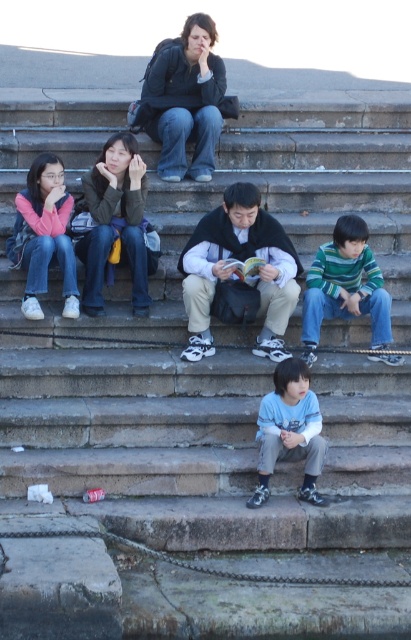
How distant is black matte jacket at center from matte green jacket at center?

They are 95.96 centimeters apart.

I want to click on black matte jacket at center, so click(x=235, y=268).

Which is in front, point (212, 388) or point (295, 460)?

Point (295, 460) is in front.

Does stone steps at center come behind light blue cotton shirt at lower center?

That is True.

This screenshot has width=411, height=640. What do you see at coordinates (221, 362) in the screenshot?
I see `stone steps at center` at bounding box center [221, 362].

I want to click on stone steps at center, so click(x=221, y=362).

Is point (230, 198) positioned before point (380, 284)?

Yes, point (230, 198) is closer to viewer.

Between black matte jacket at center and striped knit sweater at right, which one is positioned higher?

black matte jacket at center is above.

This screenshot has width=411, height=640. What are the coordinates of `black matte jacket at center` in the screenshot? It's located at (235, 268).

Locate an element on the screen. The height and width of the screenshot is (640, 411). black matte jacket at center is located at coordinates (235, 268).